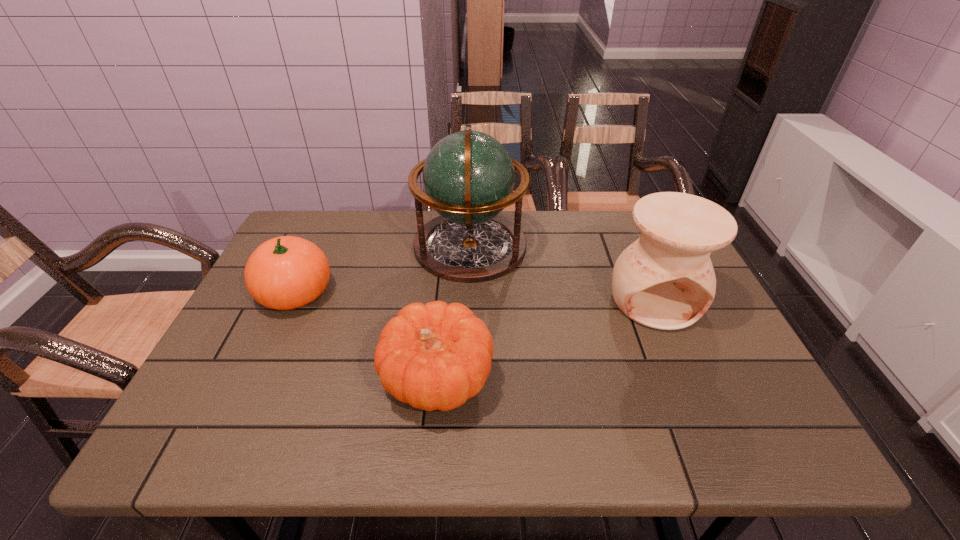
Find the location of a particular element. This screenshot has height=540, width=960. free spot between the nearest object and the rightmost object is located at coordinates (546, 340).

The height and width of the screenshot is (540, 960). Find the location of `empty space between the pottery and the farther pumpkin`. empty space between the pottery and the farther pumpkin is located at coordinates (475, 296).

I want to click on free space between the leftmost object and the right pumpkin, so click(366, 336).

Locate an element on the screen. This screenshot has width=960, height=540. free space that is in between the pottery and the right pumpkin is located at coordinates (546, 340).

The image size is (960, 540). I want to click on vacant area that lies between the second tallest object and the tallest object, so click(563, 273).

Where is `vacant area that lies between the globe and the leftmost object`? Image resolution: width=960 pixels, height=540 pixels. vacant area that lies between the globe and the leftmost object is located at coordinates (383, 269).

Find the location of a particular element. The height and width of the screenshot is (540, 960). blank region between the second tallest object and the globe is located at coordinates (563, 273).

This screenshot has height=540, width=960. What are the coordinates of `vacant point located between the farther pumpkin and the second tallest object` in the screenshot? It's located at (475, 296).

Locate which object is the closest to the leftmost object. Please provide its 2D coordinates. Your answer should be formatted as a tuple, i.e. [(x, y)], where the tuple contains the x and y coordinates of a point satisfying the conditions above.

[(435, 356)]

At what (x,y) coordinates should I click in order to perform the action: click on the closest object relative to the pottery. Please return your answer as a coordinate pair (x, y). The image size is (960, 540). Looking at the image, I should click on (468, 177).